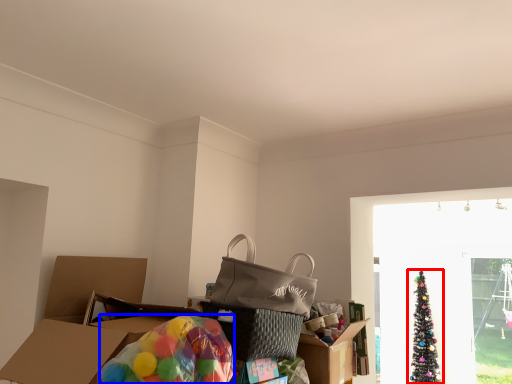
Question: Among these objects, which one is nearest to the camera, christmas tree (highlighted by a red box) or balloon (highlighted by a blue box)?

Choices:
 (A) christmas tree
 (B) balloon

Answer: (B)